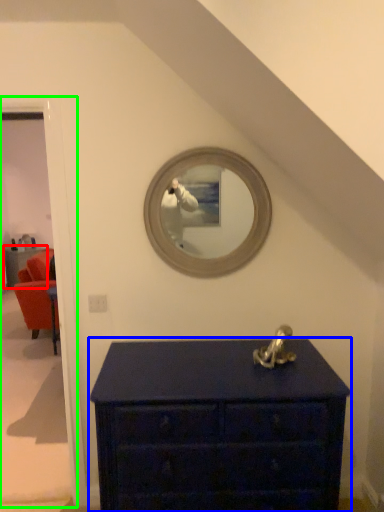
Question: Considering the real-world distances, which object is closest to furniture (highlighted by a red box)? chest of drawers (highlighted by a blue box) or door (highlighted by a green box).

Choices:
 (A) chest of drawers
 (B) door

Answer: (B)